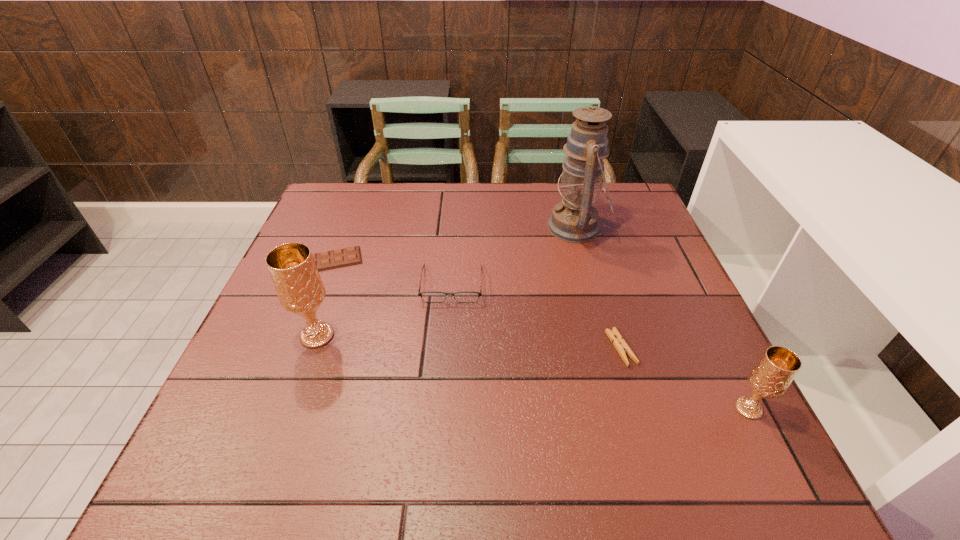
At what (x,y) coordinates should I click in order to perform the action: click on free space located on the left of the fourth shortest object. Please return your answer as a coordinate pair (x, y). This screenshot has height=540, width=960. Looking at the image, I should click on (594, 409).

This screenshot has height=540, width=960. I want to click on free space located 0.360m on the front of the tallest object, so click(613, 361).

At what (x,y) coordinates should I click in order to perform the action: click on vacant region located 0.290m on the front-facing side of the third object from left to right. Please return your answer as a coordinate pair (x, y). The width and height of the screenshot is (960, 540). Looking at the image, I should click on (443, 415).

The height and width of the screenshot is (540, 960). What are the coordinates of `blank space located on the back of the chocolate bar` in the screenshot? It's located at (359, 192).

Where is `free space located 0.110m on the left of the clothespin`? Image resolution: width=960 pixels, height=540 pixels. free space located 0.110m on the left of the clothespin is located at coordinates (557, 348).

I want to click on object that is at the far edge, so click(574, 219).

Locate an element on the screen. object that is at the near edge is located at coordinates (771, 376).

Where is `chalice situated at the left edge`? The width and height of the screenshot is (960, 540). chalice situated at the left edge is located at coordinates (295, 276).

Find the location of a particular element. The width and height of the screenshot is (960, 540). chocolate bar at the left edge is located at coordinates (328, 260).

This screenshot has width=960, height=540. In order to click on chalice that is at the right edge in this screenshot , I will do point(771,376).